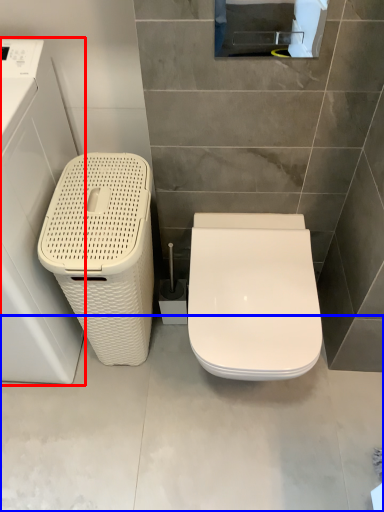
Question: Among these objects, which one is nearest to the camera, washing machine (highlighted by a red box) or concrete (highlighted by a blue box)?

Choices:
 (A) washing machine
 (B) concrete

Answer: (A)